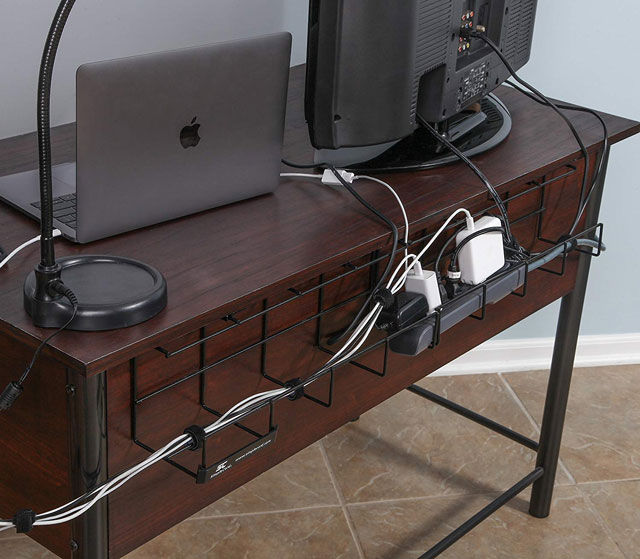
At what (x,y) coordinates should I click in order to perform the action: click on velcro cable holders. Please return your answer as a coordinate pair (x, y). Image resolution: width=640 pixels, height=559 pixels. Looking at the image, I should click on (573, 239), (381, 296), (299, 387), (198, 434), (22, 522).